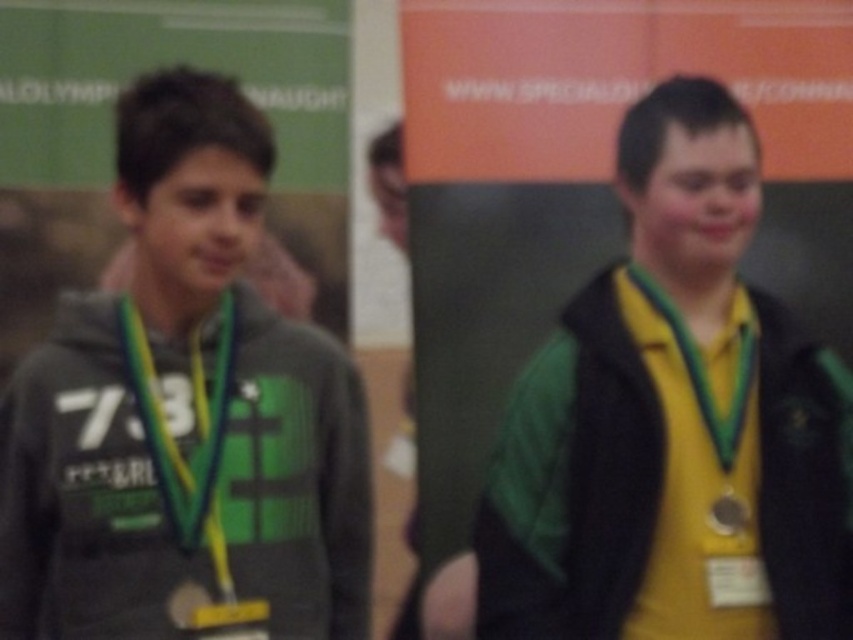
You are standing in the room where the two people are. You want to find the black matte vest at right. Where should you look relative to the other person in the image?

The black matte vest at right is located at coordinates 0.775 on the x axis and 0.685 on the y axis, so you should look towards the right side of the image where the person on the right is standing.

You are a photographer at an event and need to ensure both the green fabric neck at center and the metallic silver medal at right are visible in the photo. Given their sizes, which object should you focus on to frame the shot properly?

The green fabric neck at center is much taller than the metallic silver medal at right, so you should focus on the green fabric neck at center to ensure it is framed properly while the medal will naturally fit into the frame due to its smaller size.